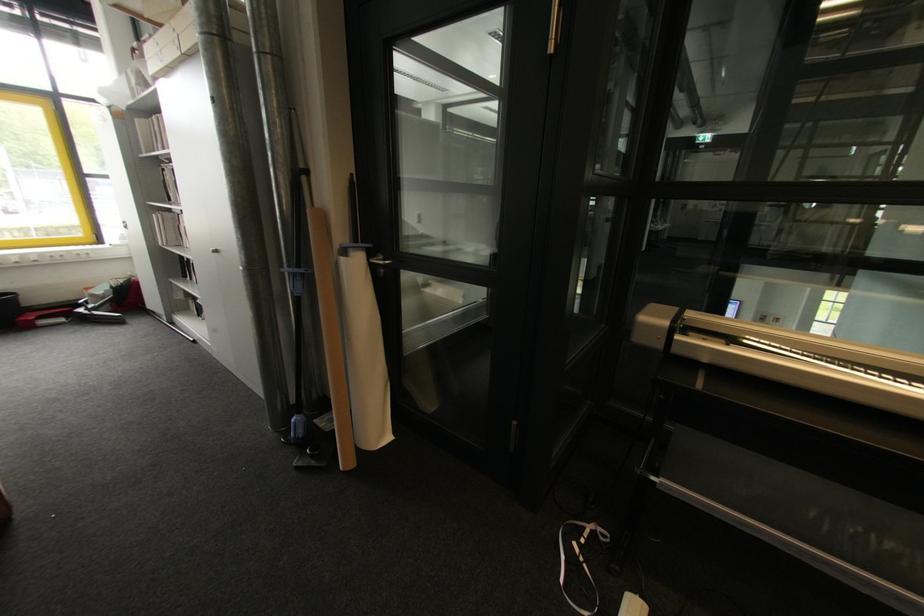
The image size is (924, 616). Find the location of `white binder`. white binder is located at coordinates (630, 605).